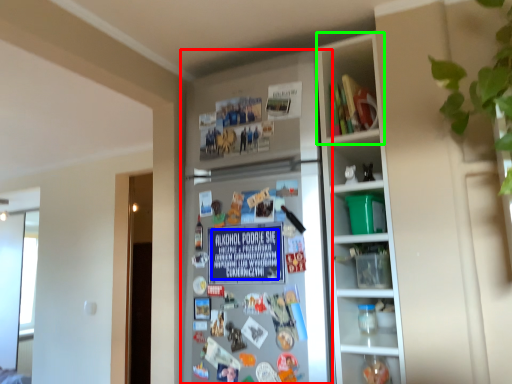
Question: Which object is positioned closest to fridge (highlighted by a red box)? Select from writing (highlighted by a blue box) and cabinet (highlighted by a green box).

Choices:
 (A) writing
 (B) cabinet

Answer: (A)